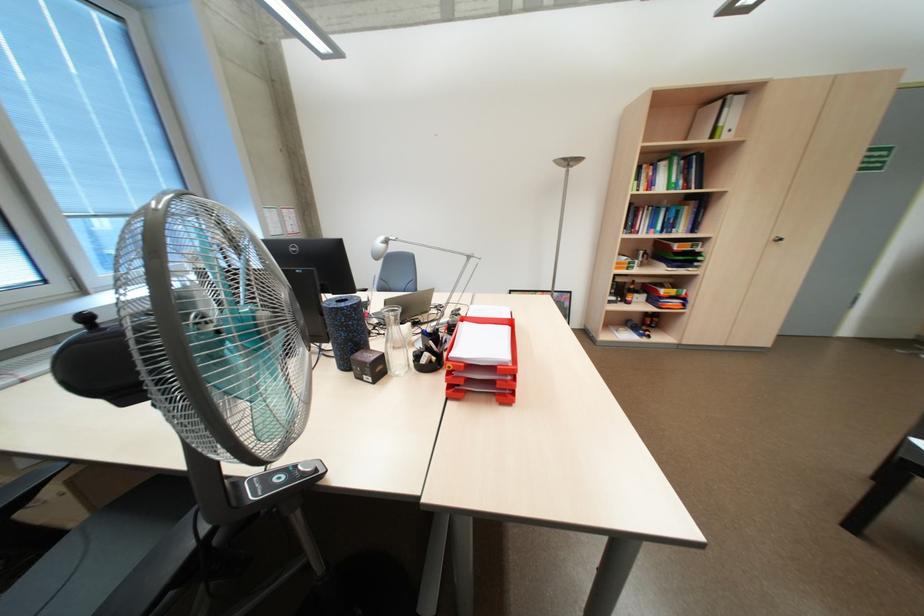
At what (x,y) coordinates should I click in order to perform the action: click on silver lamp head. Please return your answer as a coordinate pair (x, y). This screenshot has height=616, width=924. Looking at the image, I should click on (381, 246).